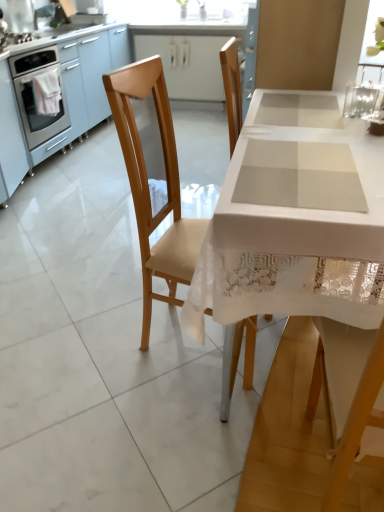
Question: Could you tell me if white lace table at center is turned towards stainless steel oven at left?

Choices:
 (A) yes
 (B) no

Answer: (B)

Question: Can you confirm if white lace table at center is thinner than stainless steel oven at left?

Choices:
 (A) yes
 (B) no

Answer: (B)

Question: Does white lace table at center lie in front of stainless steel oven at left?

Choices:
 (A) yes
 (B) no

Answer: (A)

Question: Are white lace table at center and stainless steel oven at left making contact?

Choices:
 (A) no
 (B) yes

Answer: (A)

Question: Can you confirm if white lace table at center is taller than stainless steel oven at left?

Choices:
 (A) yes
 (B) no

Answer: (A)

Question: Looking at the image, does matte white cabinet at upper center seem bigger or smaller compared to stainless steel oven at left?

Choices:
 (A) big
 (B) small

Answer: (B)

Question: From a real-world perspective, is matte white cabinet at upper center positioned above or below stainless steel oven at left?

Choices:
 (A) above
 (B) below

Answer: (B)

Question: In terms of width, does matte white cabinet at upper center look wider or thinner when compared to stainless steel oven at left?

Choices:
 (A) thin
 (B) wide

Answer: (A)

Question: In the image, is matte white cabinet at upper center positioned in front of or behind stainless steel oven at left?

Choices:
 (A) behind
 (B) front

Answer: (A)

Question: Relative to pink fabric at left, is white lace table at center in front or behind?

Choices:
 (A) front
 (B) behind

Answer: (A)

Question: Considering the positions of point (324, 279) and point (39, 97), is point (324, 279) closer or farther from the camera than point (39, 97)?

Choices:
 (A) closer
 (B) farther

Answer: (A)

Question: In terms of size, does white lace table at center appear bigger or smaller than pink fabric at left?

Choices:
 (A) big
 (B) small

Answer: (A)

Question: From a real-world perspective, is white lace table at center physically located above or below pink fabric at left?

Choices:
 (A) below
 (B) above

Answer: (A)

Question: Considering the positions of stainless steel oven at left and pink fabric at left in the image, is stainless steel oven at left bigger or smaller than pink fabric at left?

Choices:
 (A) small
 (B) big

Answer: (B)

Question: Considering the positions of stainless steel oven at left and pink fabric at left in the image, is stainless steel oven at left wider or thinner than pink fabric at left?

Choices:
 (A) wide
 (B) thin

Answer: (A)